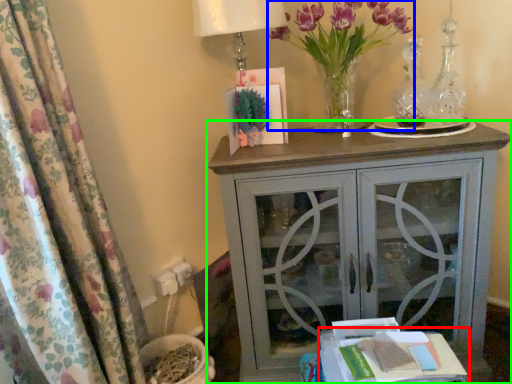
Question: Which is farther away from table (highlighted by a red box)? floral arrangement (highlighted by a blue box) or nightstand (highlighted by a green box)?

Choices:
 (A) floral arrangement
 (B) nightstand

Answer: (A)